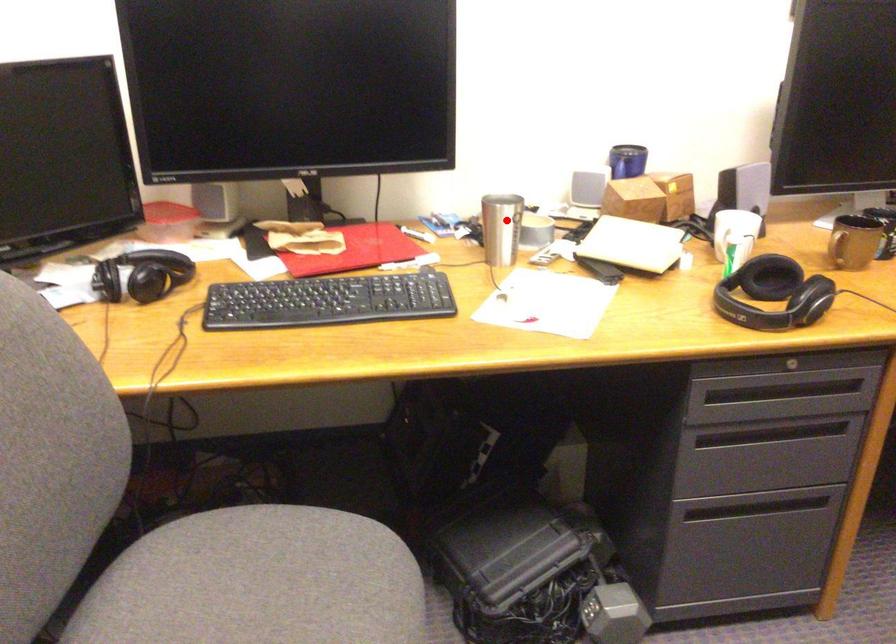
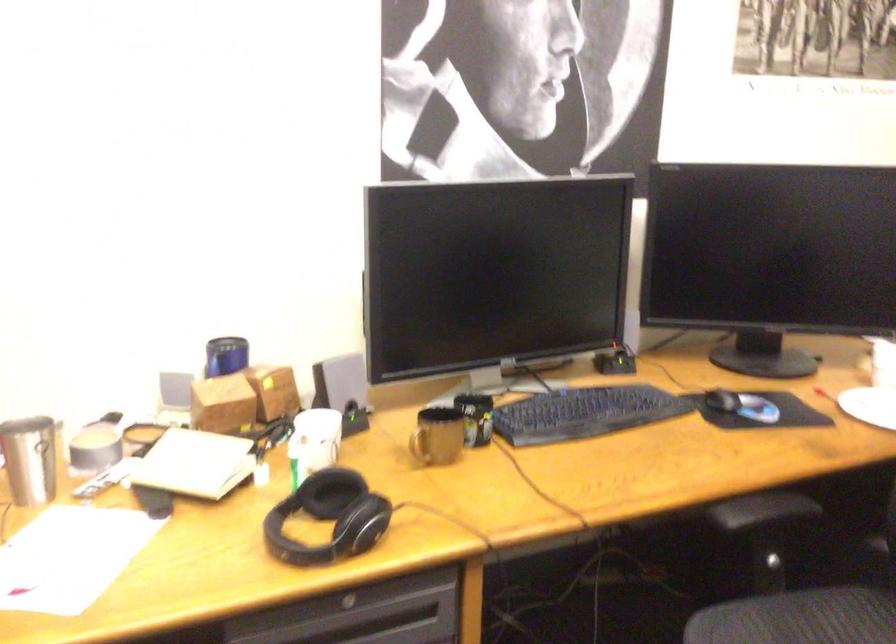
Question: I am providing you with two images of the same scene from different viewpoints. Image1 has a red point marked. In image2, the corresponding 3D location appears at what relative position? Reply with the corresponding letter.

Choices:
 (A) Closer
 (B) Farther

Answer: (A)